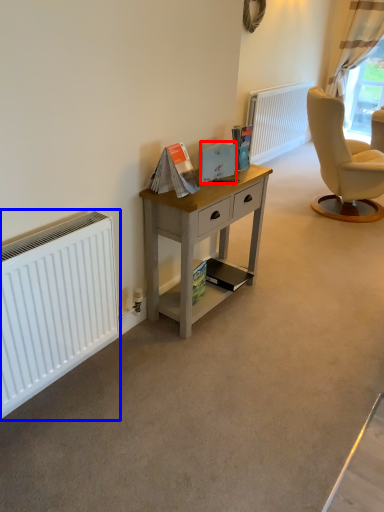
Question: Among these objects, which one is farthest to the camera, magazine (highlighted by a red box) or radiator (highlighted by a blue box)?

Choices:
 (A) magazine
 (B) radiator

Answer: (A)